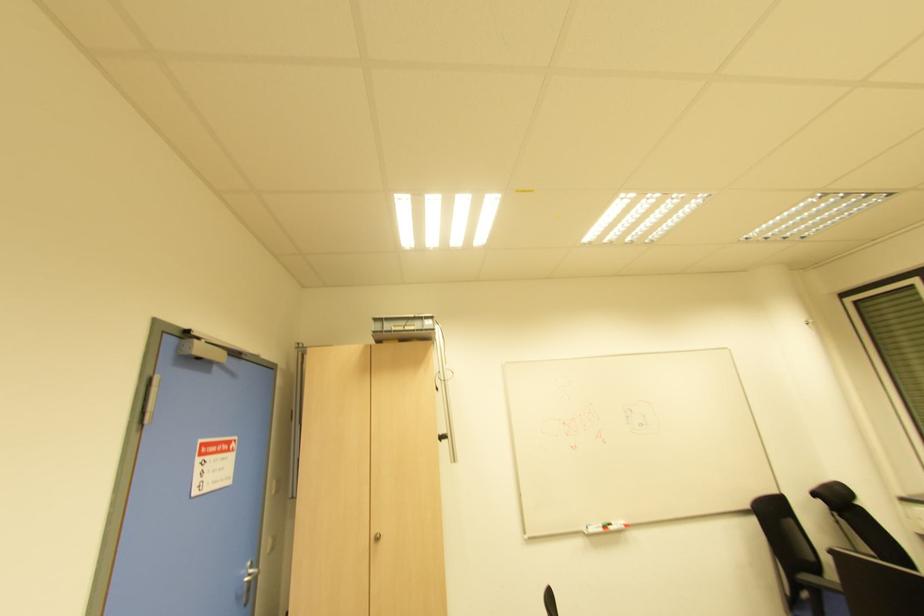
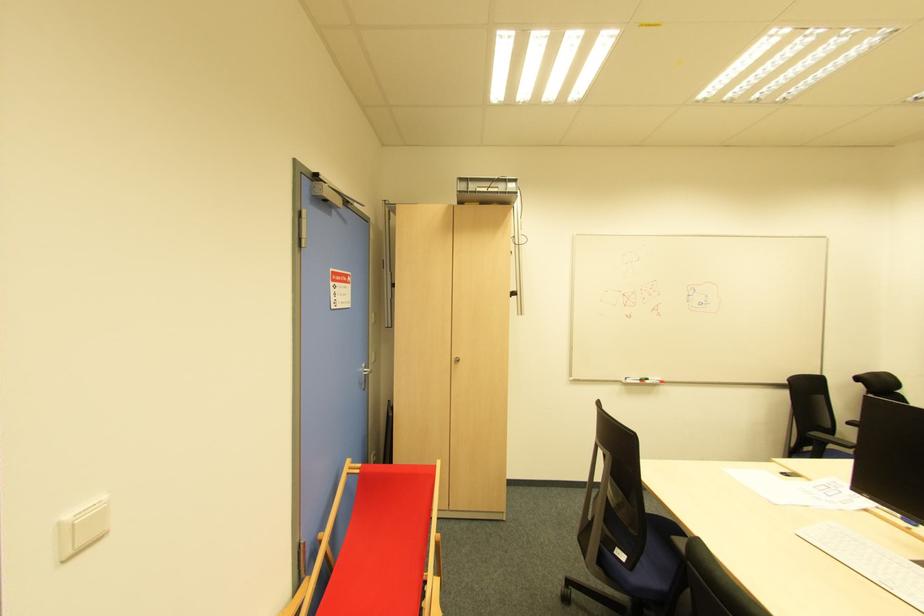
In the second image, find the point that corresponds to point (610, 528) in the first image.

(647, 383)